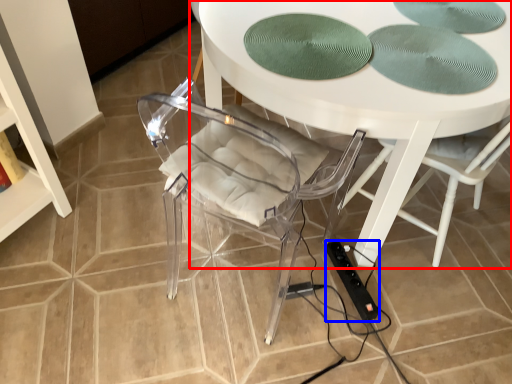
Question: Which of the following is the farthest to the observer, table (highlighted by a red box) or extension cord (highlighted by a blue box)?

Choices:
 (A) table
 (B) extension cord

Answer: (B)